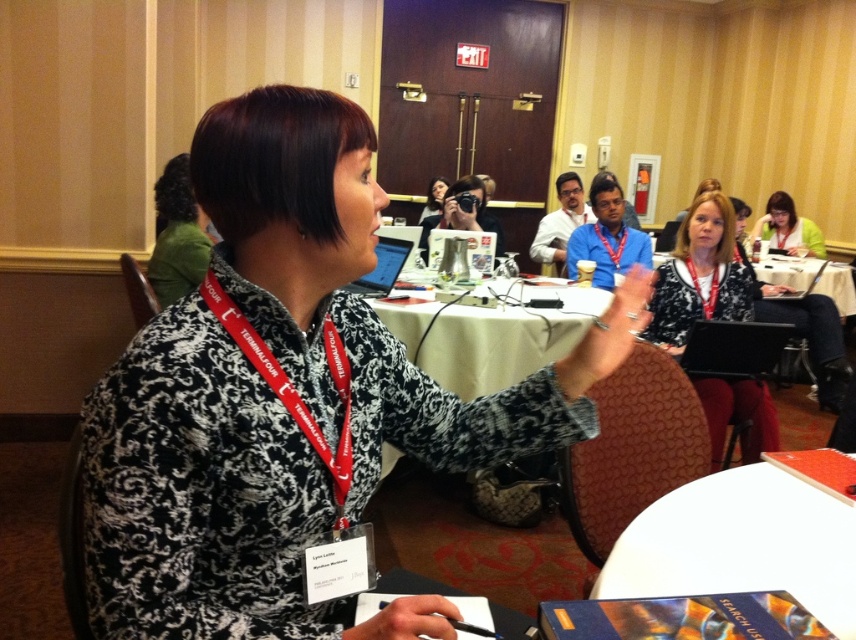
You are a participant in the conference and want to place a small notebook on the white paper at lower right and the white fabric table at center. Which surface is closer to you?

The white paper at lower right is closer to the viewer than the white fabric table at center, so you can place the notebook there first.

What are the coordinates of the matte black jacket at center?

The matte black jacket at center is located at point (699,276).

You are a participant in the conference and you need to place a small object on the white paper at lower right. To ensure it doesn not fall off, should you place it closer to the edge near the white fabric table at center or the opposite edge?

You should place the small object closer to the edge near the white fabric table at center because the white paper at lower right is positioned to the right of the white fabric table at center, so the edge closer to the table would be the left edge of the paper. Placing it there would keep it away from the paper s edge that is farther from the table, reducing the chance of it falling off.